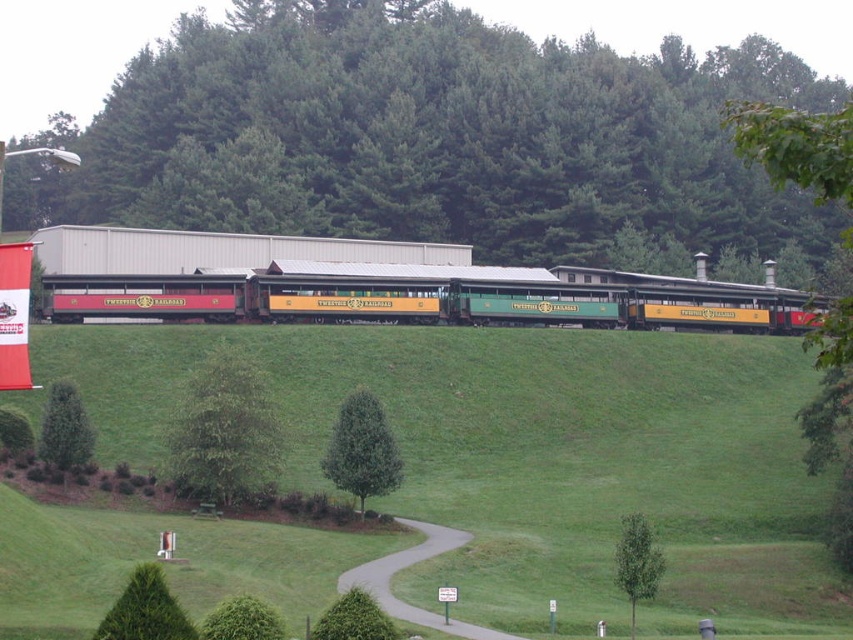
Question: Can you confirm if green leafy tree at upper center is bigger than green matte tree at center?

Choices:
 (A) no
 (B) yes

Answer: (B)

Question: Is green grassy hillside at upper center bigger than green leafy tree at lower right?

Choices:
 (A) no
 (B) yes

Answer: (B)

Question: Estimate the real-world distances between objects in this image. Which object is closer to the green grassy hillside at upper center?

Choices:
 (A) green leafy tree at upper center
 (B) green leafy tree at lower left
 (C) green matte train car at center

Answer: (C)

Question: Which point is farther to the camera?

Choices:
 (A) green leafy tree at lower right
 (B) green leafy tree at center

Answer: (B)

Question: Does green leafy tree at center come in front of green leafy tree at lower right?

Choices:
 (A) no
 (B) yes

Answer: (A)

Question: Which object appears closest to the camera in this image?

Choices:
 (A) green leafy tree at center
 (B) green grassy hillside at upper center
 (C) green matte tree at center
 (D) green leafy tree at upper center

Answer: (B)